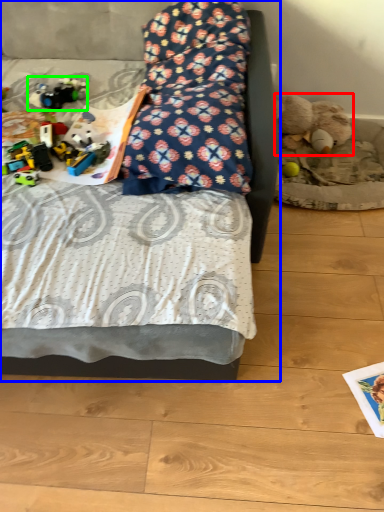
Question: Based on their relative distances, which object is nearer to teddy bear (highlighted by a red box)? Choose from bed (highlighted by a blue box) and toy (highlighted by a green box).

Choices:
 (A) bed
 (B) toy

Answer: (B)